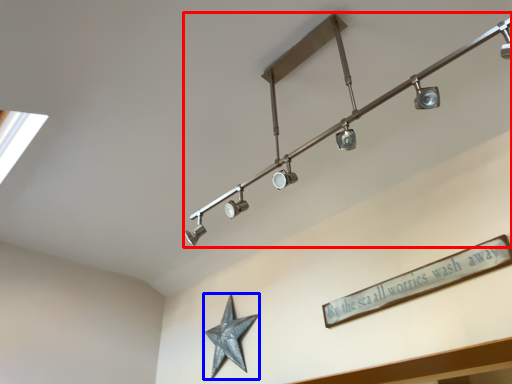
Question: Which object appears closest to the camera in this image, lamp (highlighted by a red box) or star (highlighted by a blue box)?

Choices:
 (A) lamp
 (B) star

Answer: (A)